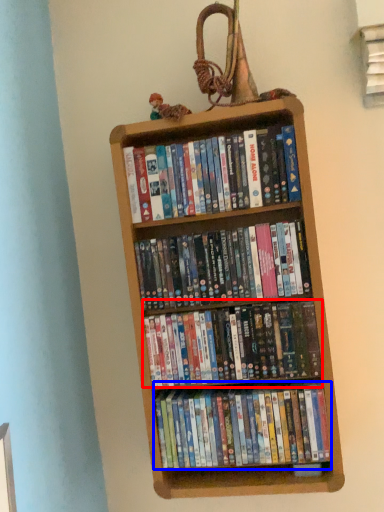
Question: Among these objects, which one is nearest to the camera, book (highlighted by a red box) or book (highlighted by a blue box)?

Choices:
 (A) book
 (B) book

Answer: (A)